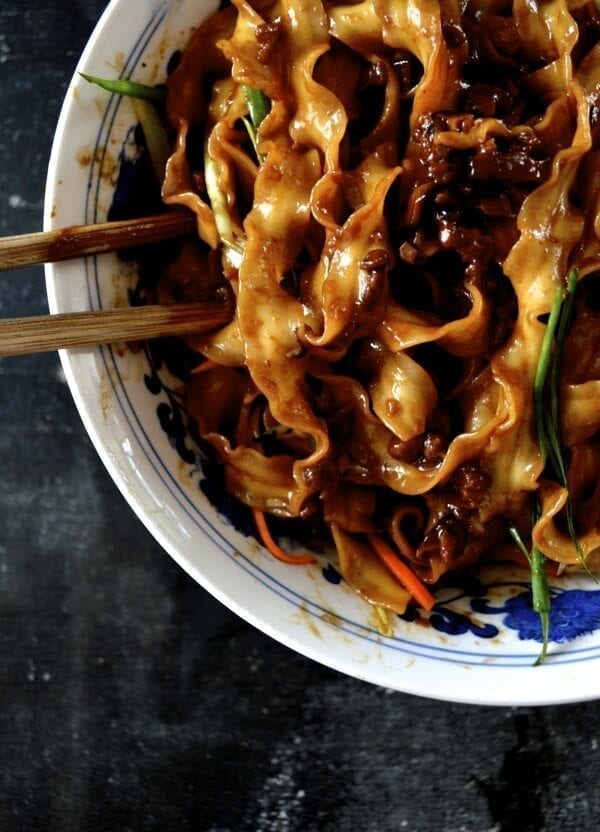
I want to click on bowl, so click(x=249, y=590).